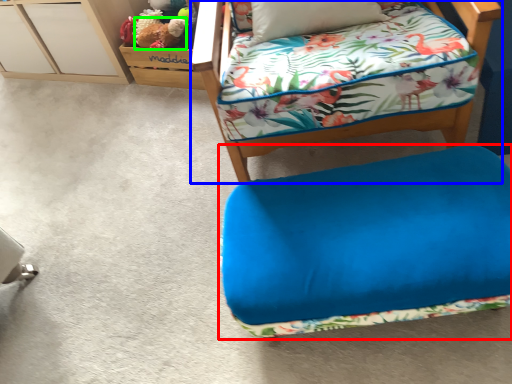
Question: Based on their relative distances, which object is farther from furniture (highlighted by a red box)? Choose from furniture (highlighted by a blue box) and animal (highlighted by a green box).

Choices:
 (A) furniture
 (B) animal

Answer: (B)